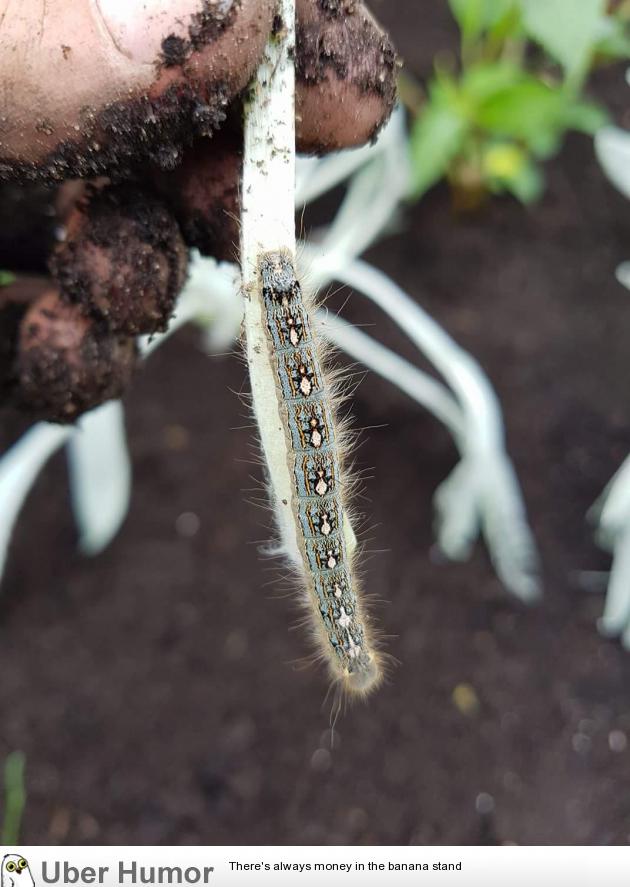
You are a GUI agent. You are given a task and a screenshot of the screen. Output one action in this format:
    pyautogui.click(x=<x>, y=<y>)
    Task: Click on the plant with darker green leaves
    
    Given the screenshot: What is the action you would take?
    pyautogui.click(x=547, y=112), pyautogui.click(x=581, y=24), pyautogui.click(x=466, y=14)